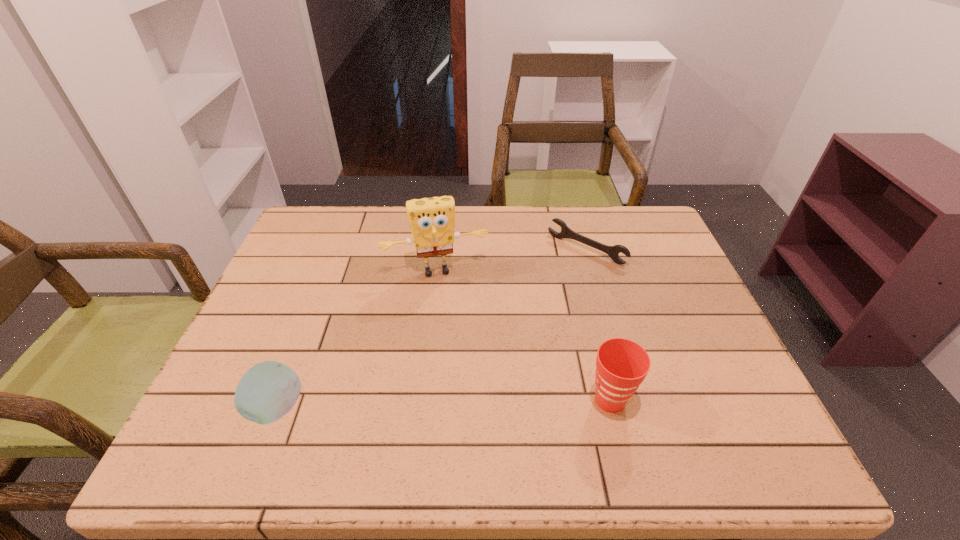
Find the location of a particular element. The image size is (960, 540). free space on the desktop that is between the third tallest object and the third shortest object and is positioned on the face of the second object from left to right is located at coordinates (464, 404).

Locate an element on the screen. The height and width of the screenshot is (540, 960). free space on the desktop that is between the leftmost object and the cup and is positioned on the open ends of the shortest object is located at coordinates (435, 405).